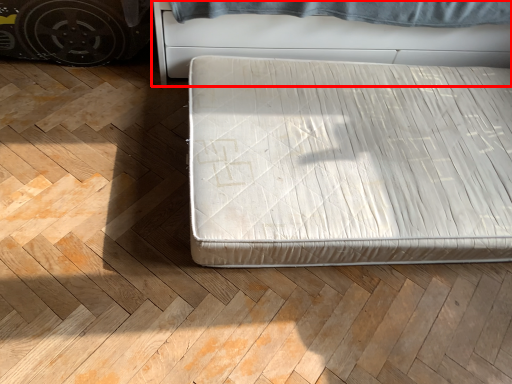
Question: Considering the relative positions of furniture (annotated by the red box) and bed in the image provided, where is furniture (annotated by the red box) located with respect to the staircase?

Choices:
 (A) left
 (B) right

Answer: (B)